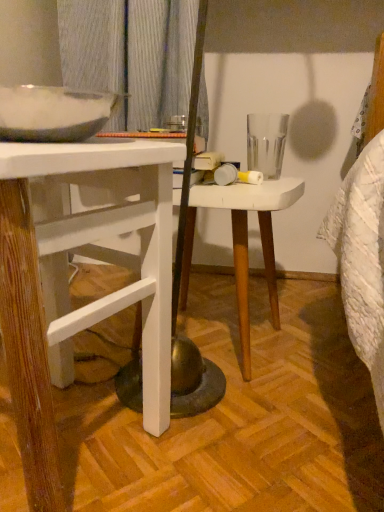
In order to face white wood desk at left, should I rotate leftwards or rightwards?

A 19.433 degree turn to the left will do.

Describe the element at coordinates (67, 279) in the screenshot. The image size is (384, 512). I see `white wood desk at left` at that location.

This screenshot has height=512, width=384. Identify the location of white wood desk at left. (67, 279).

Consider the image. Measure the distance between point [36,164] and camera.

The depth of point [36,164] is 14.61 inches.

What do you see at coordinates (243, 241) in the screenshot? The width and height of the screenshot is (384, 512). I see `white matte stool at center` at bounding box center [243, 241].

Image resolution: width=384 pixels, height=512 pixels. What are the coordinates of `white matte stool at center` in the screenshot? It's located at (243, 241).

Identify the location of white wood desk at left. The image size is (384, 512). click(67, 279).

Is white wood desk at left at the left side of white matte stool at center?

Yes, white wood desk at left is to the left of white matte stool at center.

Consider the image. Is white wood desk at left positioned before white matte stool at center?

Yes, the depth of white wood desk at left is less than that of white matte stool at center.

Which point is more forward, (137, 301) or (175, 192)?

Point (137, 301)

From the image's perspective, is white wood desk at left positioned above or below white matte stool at center?

Based on their image positions, white wood desk at left is located beneath white matte stool at center.

From a real-world perspective, is white wood desk at left above or below white matte stool at center?

white wood desk at left is above white matte stool at center.

Can you confirm if white wood desk at left is thinner than white matte stool at center?

No, white wood desk at left is not thinner than white matte stool at center.

Who is taller, white wood desk at left or white matte stool at center?

With more height is white wood desk at left.

Considering the sizes of objects white wood desk at left and white matte stool at center in the image provided, who is bigger, white wood desk at left or white matte stool at center?

white wood desk at left.

Would you say white wood desk at left is inside or outside white matte stool at center?

white wood desk at left is outside white matte stool at center.

In the scene shown: Can you see white wood desk at left touching white matte stool at center?

white wood desk at left is not next to white matte stool at center, and they're not touching.

Is white wood desk at left looking in the opposite direction of white matte stool at center?

white wood desk at left is not turned away from white matte stool at center.

From the picture: Can you tell me how much white wood desk at left and white matte stool at center differ in facing direction?

The angle between the facing direction of white wood desk at left and the facing direction of white matte stool at center is 12.9 degrees.

Measure the distance from white wood desk at left to white matte stool at center.

10.31 inches.

There is a white matte stool at center. Identify the location of desk above it (from a real-world perspective). (67, 279).

Which object is positioned more to the left, white matte stool at center or white wood desk at left?

Positioned to the left is white wood desk at left.

Which object is closer to the camera taking this photo, white matte stool at center or white wood desk at left?

white wood desk at left is in front.

Which is closer, (239, 331) or (26, 285)?

Point (239, 331) appears to be farther away from the viewer than point (26, 285).

From the image's perspective, is white matte stool at center above white wood desk at left?

Yes, from the image's perspective, white matte stool at center is over white wood desk at left.

From a real-world perspective, which object rests below the other?

white matte stool at center, from a real-world perspective.

Looking at their sizes, would you say white matte stool at center is wider or thinner than white wood desk at left?

Considering their sizes, white matte stool at center looks slimmer than white wood desk at left.

From their relative heights in the image, would you say white matte stool at center is taller or shorter than white wood desk at left?

Clearly, white matte stool at center is shorter compared to white wood desk at left.

Does white matte stool at center have a larger size compared to white wood desk at left?

Incorrect, white matte stool at center is not larger than white wood desk at left.

Is white wood desk at left completely or partially inside white matte stool at center?

No, white wood desk at left is not a part of white matte stool at center.

Is white matte stool at center directly adjacent to white wood desk at left?

No, white matte stool at center is not next to white wood desk at left.

Is white matte stool at center positioned with its back to white wood desk at left?

No, white matte stool at center is not facing away from white wood desk at left.

Find the location of `desk that appears in front of the white matte stool at center`. desk that appears in front of the white matte stool at center is located at coordinates (67, 279).

The width and height of the screenshot is (384, 512). Identify the location of stool below the white wood desk at left (from a real-world perspective). (243, 241).

Where is `desk that appears below the white matte stool at center (from the image's perspective)`? The width and height of the screenshot is (384, 512). desk that appears below the white matte stool at center (from the image's perspective) is located at coordinates (67, 279).